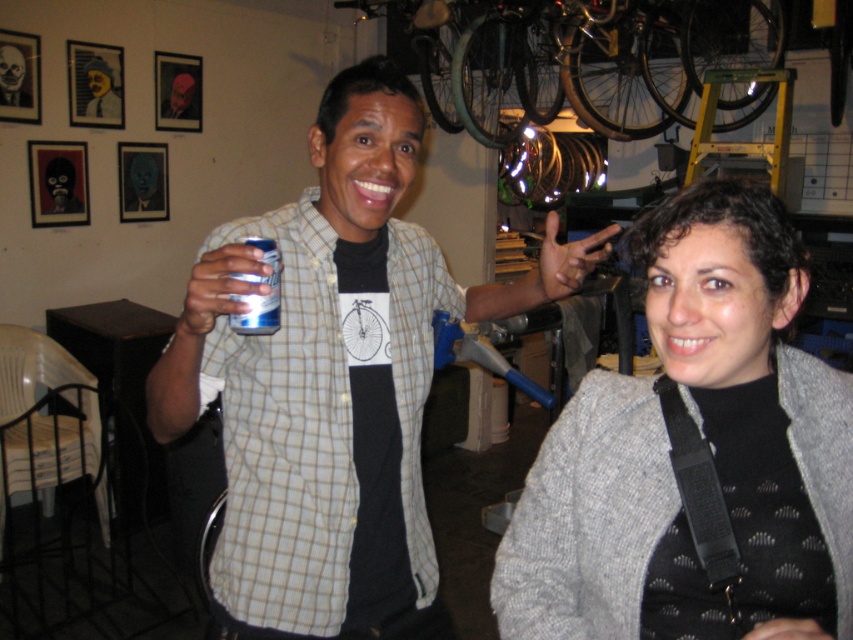
You are a delivery robot that needs to place a metallic blue can at center into the matte black hand at upper center. Given that your arm can reach up to 18 inches, will you be able to reach the hand from the can?

The metallic blue can at center and matte black hand at upper center are 18.65 inches apart. Since your arm can only reach up to 18 inches, you cannot reach the hand from the can.